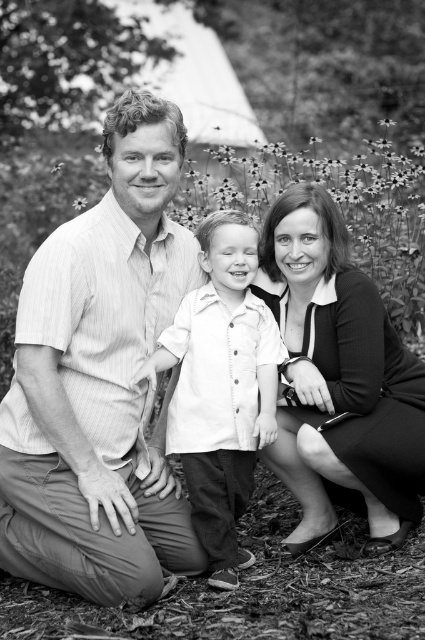
Is point (172, 273) behind point (272, 259)?

That is False.

Does striped cotton shirt at left have a larger size compared to black smooth dress at center?

Correct, striped cotton shirt at left is larger in size than black smooth dress at center.

Between point (30, 499) and point (351, 337), which one is positioned in front?

Positioned in front is point (30, 499).

I want to click on striped cotton shirt at left, so click(99, 380).

Measure the distance between black smooth dress at center and white button-down shirt at center.

13.70 inches

Is black smooth dress at center positioned at the back of white button-down shirt at center?

Yes, black smooth dress at center is further from the viewer.

Is point (391, 500) more distant than point (223, 568)?

Yes, it is.

Find the location of a particular element. The width and height of the screenshot is (425, 640). black smooth dress at center is located at coordinates (339, 378).

Is striped cotton shirt at left positioned before white button-down shirt at center?

Yes.

Is point (113, 344) farther from camera compared to point (243, 477)?

No, (113, 344) is in front of (243, 477).

The image size is (425, 640). What are the coordinates of `striped cotton shirt at left` in the screenshot? It's located at [x=99, y=380].